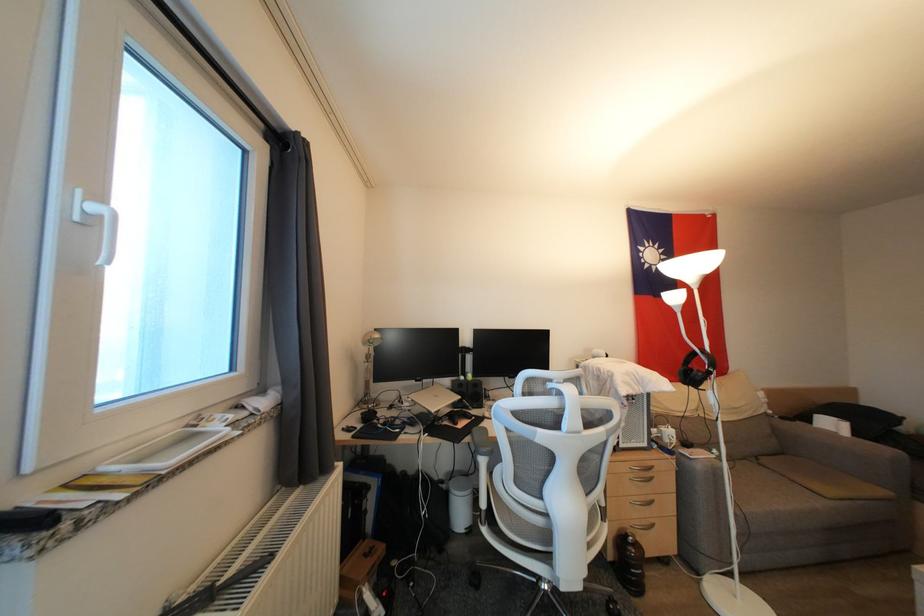
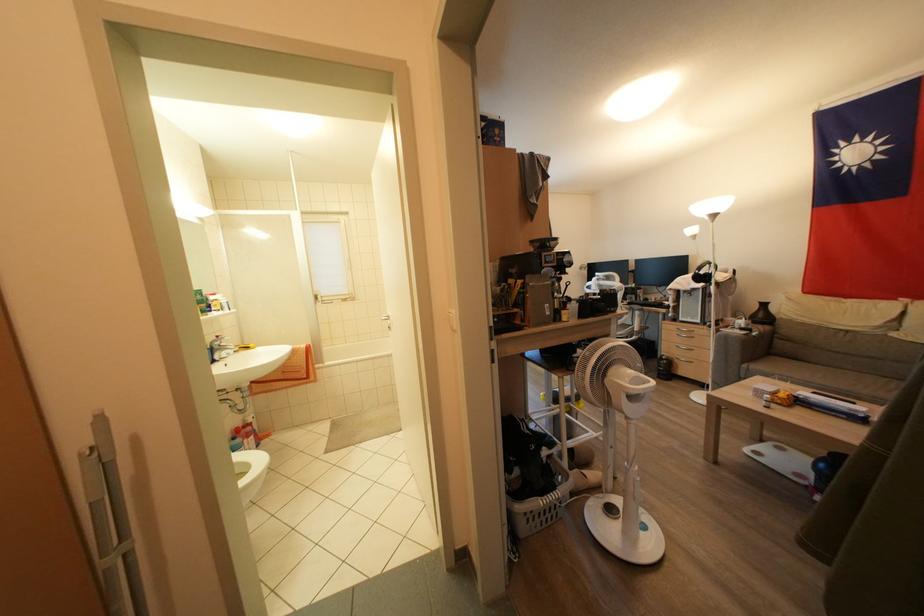
Question: I am providing you with two images of the same scene from different viewpoints. Please identify which objects are invisible in image2.

Choices:
 (A) sofa sitting surface
 (B) white window handle
 (C) lamp gooseneck
 (D) black vase

Answer: (B)